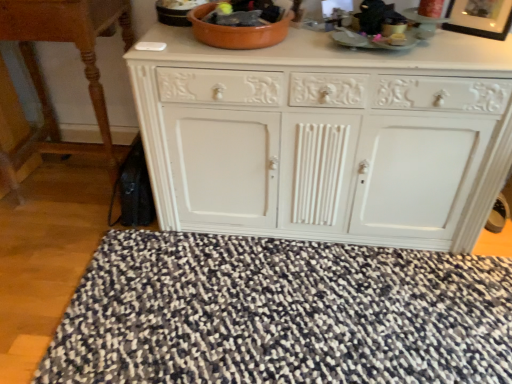
Image resolution: width=512 pixels, height=384 pixels. In order to click on white painted wood cabinet at center in this screenshot , I will do [326, 138].

The image size is (512, 384). Identify the location of black glossy picture frame at upper right. (480, 18).

From the image's perspective, is black glossy picture frame at upper right beneath white painted wood cabinet at center?

No, from the image's perspective, black glossy picture frame at upper right is not below white painted wood cabinet at center.

At what (x,y) coordinates should I click in order to perform the action: click on the chest of drawers that appears below the black glossy picture frame at upper right (from the image's perspective). Please return your answer as a coordinate pair (x, y). The image size is (512, 384). Looking at the image, I should click on (326, 138).

Is black glossy picture frame at upper right facing away from white painted wood cabinet at center?

black glossy picture frame at upper right does not have its back to white painted wood cabinet at center.

Are black glossy picture frame at upper right and white painted wood cabinet at center located far from each other?

No, black glossy picture frame at upper right is not far away from white painted wood cabinet at center.

Between white painted wood cabinet at center and black glossy picture frame at upper right, which one has less height?

With less height is black glossy picture frame at upper right.

In order to click on picture frame on the right of white painted wood cabinet at center in this screenshot , I will do `click(480, 18)`.

Does white painted wood cabinet at center have a smaller size compared to black glossy picture frame at upper right?

No.

From the image's perspective, is speckled fabric doormat at lower center located above or below wooden table at left?

From the image's perspective, speckled fabric doormat at lower center appears below wooden table at left.

Is speckled fabric doormat at lower center taller or shorter than wooden table at left?

In the image, speckled fabric doormat at lower center appears to be shorter than wooden table at left.

From a real-world perspective, which is physically above, speckled fabric doormat at lower center or wooden table at left?

From a 3D spatial view, wooden table at left is above.

Does black glossy picture frame at upper right turn towards wooden table at left?

No, black glossy picture frame at upper right is not turned towards wooden table at left.

Is black glossy picture frame at upper right positioned beyond the bounds of wooden table at left?

Absolutely, black glossy picture frame at upper right is external to wooden table at left.

Consider the image. Considering the relative positions of black glossy picture frame at upper right and wooden table at left in the image provided, is black glossy picture frame at upper right to the left of wooden table at left from the viewer's perspective?

No.

Considering the relative sizes of white painted wood cabinet at center and wooden table at left in the image provided, is white painted wood cabinet at center thinner than wooden table at left?

No, white painted wood cabinet at center is not thinner than wooden table at left.

Does white painted wood cabinet at center have a greater height compared to wooden table at left?

No, white painted wood cabinet at center is not taller than wooden table at left.

Is white painted wood cabinet at center oriented towards wooden table at left?

No, white painted wood cabinet at center is not turned towards wooden table at left.

Would you consider white painted wood cabinet at center to be distant from wooden table at left?

No, white painted wood cabinet at center is in close proximity to wooden table at left.

How many degrees apart are the facing directions of black glossy picture frame at upper right and speckled fabric doormat at lower center?

The angular difference between black glossy picture frame at upper right and speckled fabric doormat at lower center is 54.4 degrees.

Is black glossy picture frame at upper right at the right side of speckled fabric doormat at lower center?

Indeed, black glossy picture frame at upper right is positioned on the right side of speckled fabric doormat at lower center.

Which is closer to the camera, (482, 20) or (280, 307)?

Point (482, 20) is closer to the camera than point (280, 307).

Are black glossy picture frame at upper right and speckled fabric doormat at lower center located far from each other?

Yes, black glossy picture frame at upper right and speckled fabric doormat at lower center are located far from each other.

Considering the sizes of objects white painted wood cabinet at center and speckled fabric doormat at lower center in the image provided, who is wider, white painted wood cabinet at center or speckled fabric doormat at lower center?

speckled fabric doormat at lower center.

Is white painted wood cabinet at center aimed at speckled fabric doormat at lower center?

Yes.

Would you consider white painted wood cabinet at center to be distant from speckled fabric doormat at lower center?

They are positioned close to each other.

Which of these two, white painted wood cabinet at center or speckled fabric doormat at lower center, stands taller?

Standing taller between the two is white painted wood cabinet at center.

Find the location of a particular element. This screenshot has width=512, height=384. picture frame above the white painted wood cabinet at center (from the image's perspective) is located at coordinates (480, 18).

Find the location of a particular element. Image resolution: width=512 pixels, height=384 pixels. picture frame that appears on the right of white painted wood cabinet at center is located at coordinates (480, 18).

When comparing their distances from white painted wood cabinet at center, does wooden table at left or black glossy picture frame at upper right seem closer?

Based on the image, black glossy picture frame at upper right appears to be nearer to white painted wood cabinet at center.

From the image, which object appears to be nearer to white painted wood cabinet at center, black glossy picture frame at upper right or wooden table at left?

Based on the image, black glossy picture frame at upper right appears to be nearer to white painted wood cabinet at center.

Considering their positions, is white painted wood cabinet at center positioned further to black glossy picture frame at upper right than speckled fabric doormat at lower center?

speckled fabric doormat at lower center.

Looking at the image, which one is located further to white painted wood cabinet at center, wooden table at left or speckled fabric doormat at lower center?

Among the two, wooden table at left is located further to white painted wood cabinet at center.

From the image, which object appears to be nearer to speckled fabric doormat at lower center, white painted wood cabinet at center or black glossy picture frame at upper right?

Based on the image, white painted wood cabinet at center appears to be nearer to speckled fabric doormat at lower center.

Considering their positions, is black glossy picture frame at upper right positioned further to speckled fabric doormat at lower center than white painted wood cabinet at center?

The object further to speckled fabric doormat at lower center is black glossy picture frame at upper right.

Based on their spatial positions, is white painted wood cabinet at center or black glossy picture frame at upper right closer to wooden table at left?

Among the two, white painted wood cabinet at center is located nearer to wooden table at left.

Looking at the image, which one is located closer to white painted wood cabinet at center, speckled fabric doormat at lower center or black glossy picture frame at upper right?

Among the two, speckled fabric doormat at lower center is located nearer to white painted wood cabinet at center.

You are a GUI agent. You are given a task and a screenshot of the screen. Output one action in this format:
    pyautogui.click(x=<x>, y=<y>)
    Task: Click on the chest of drawers located between wooden table at left and black glossy picture frame at upper right in the left-right direction
    This screenshot has height=384, width=512.
    Given the screenshot: What is the action you would take?
    pyautogui.click(x=326, y=138)

Locate an element on the screen. This screenshot has width=512, height=384. the chest of drawers that lies between black glossy picture frame at upper right and speckled fabric doormat at lower center from top to bottom is located at coordinates (326, 138).

The image size is (512, 384). What are the coordinates of `doormat situated between wooden table at left and white painted wood cabinet at center from left to right` in the screenshot? It's located at (281, 314).

Locate an element on the screen. doormat between wooden table at left and black glossy picture frame at upper right is located at coordinates (281, 314).